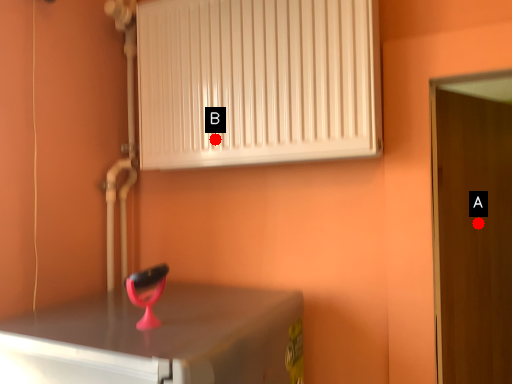
Question: Two points are circled on the image, labeled by A and B beside each circle. Which point appears farthest from the camera in this image?

Choices:
 (A) A is further
 (B) B is further

Answer: (A)